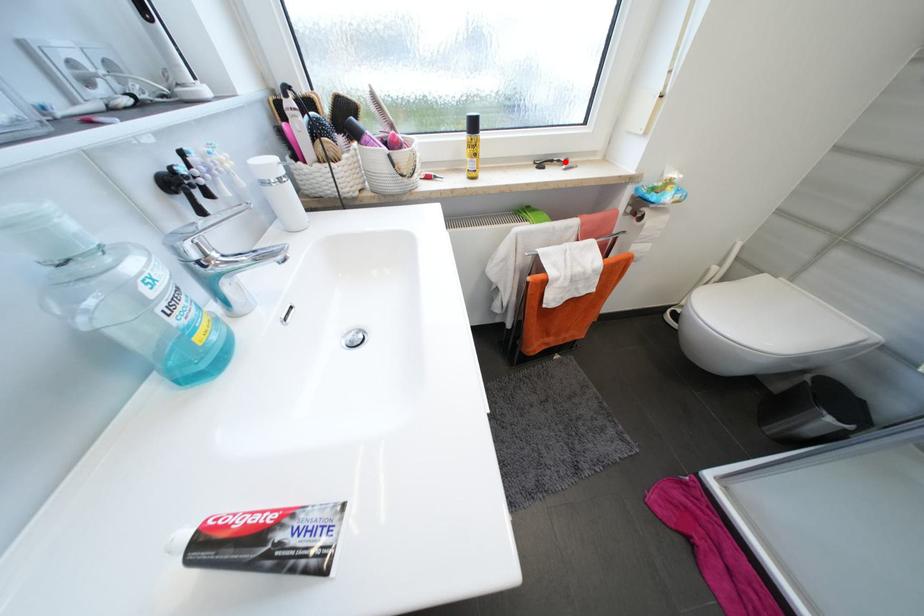
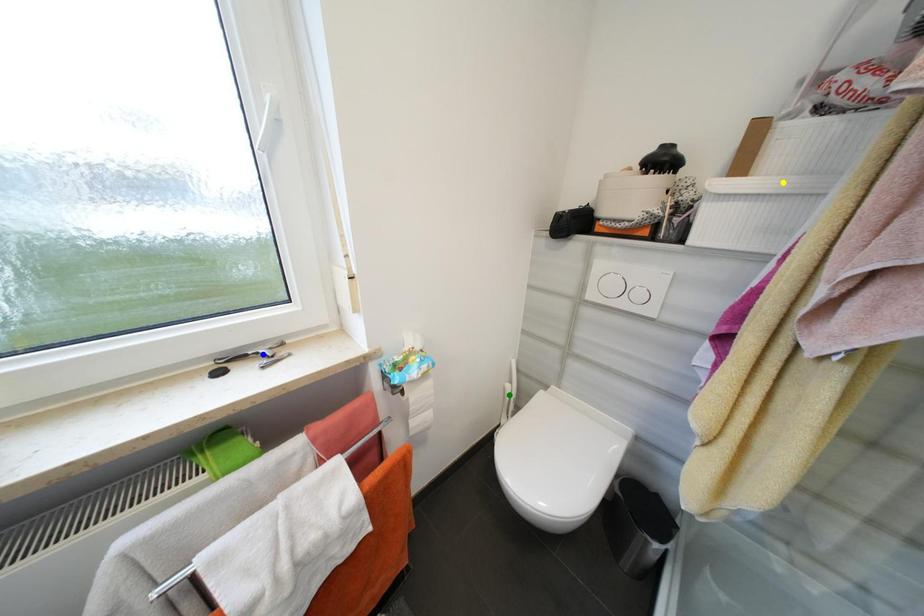
Question: I am providing you with two images of the same scene from different viewpoints. A red point is marked on the first image. You are given multiple points on the second image. Which point in image 2 is actually the same real-world point as the red point in image 1?

Choices:
 (A) blue point
 (B) yellow point
 (C) green point

Answer: (A)